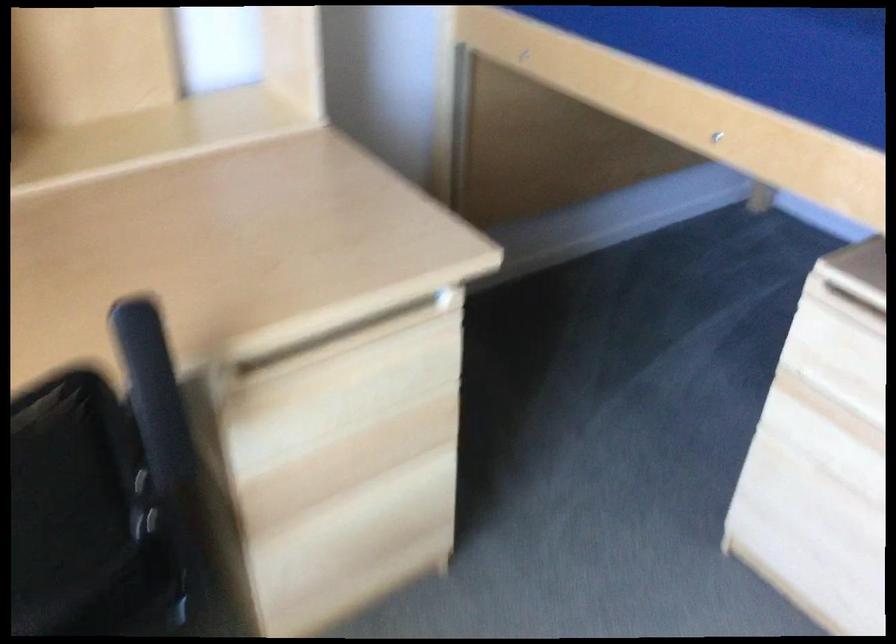
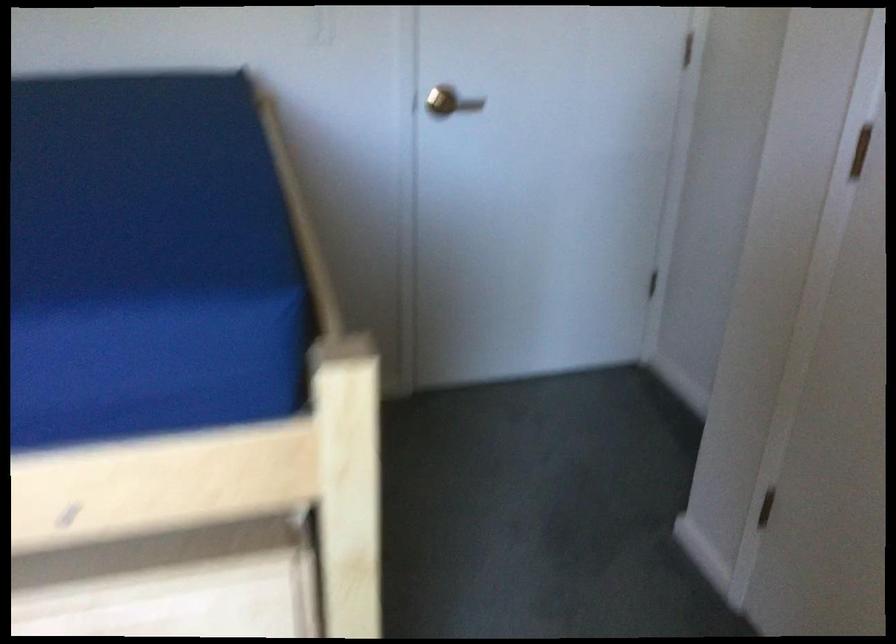
Question: The camera is either moving clockwise (left) or counter-clockwise (right) around the object. The first image is from the beginning of the video and the second image is from the end. Is the camera moving left or right when shooting the video?

Choices:
 (A) Left
 (B) Right

Answer: (A)